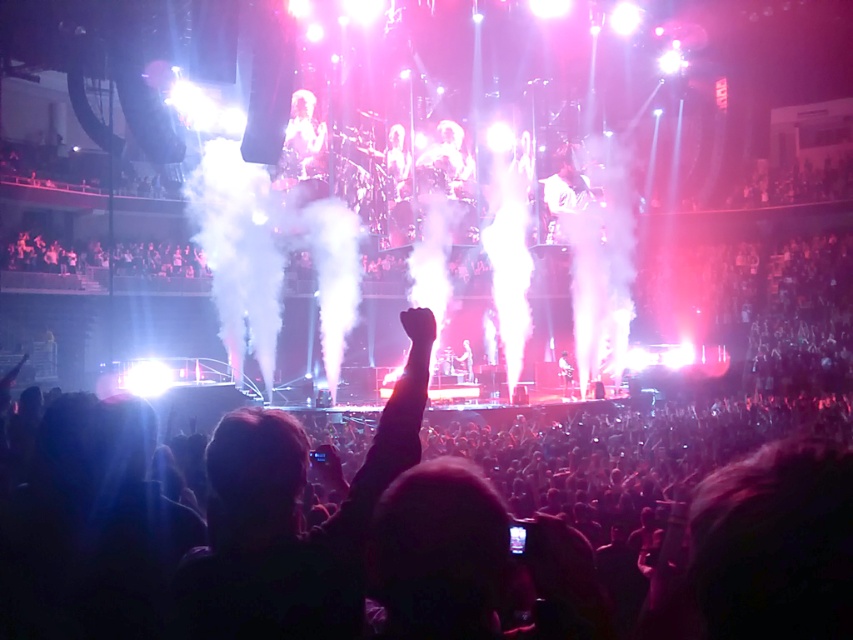
Consider the image. Does white fog at center come in front of shiny silver guitar at center?

Yes, white fog at center is closer to the viewer.

Is point (340, 252) positioned before point (471, 362)?

That is True.

Image resolution: width=853 pixels, height=640 pixels. Find the location of `white fog at center`. white fog at center is located at coordinates (268, 257).

In the scene shown: Which of these two, white fog at center or shiny black guitar at center, stands taller?

white fog at center is taller.

Does point (192, 200) lie in front of point (560, 372)?

No, it is not.

This screenshot has height=640, width=853. What do you see at coordinates (268, 257) in the screenshot?
I see `white fog at center` at bounding box center [268, 257].

In order to click on white fog at center in this screenshot , I will do `click(268, 257)`.

Between shiny black guitar at center and shiny silver guitar at center, which one is positioned higher?

shiny silver guitar at center is above.

Based on the photo, which is more to the left, shiny black guitar at center or shiny silver guitar at center?

shiny silver guitar at center

Which is in front, point (566, 353) or point (473, 371)?

Positioned in front is point (566, 353).

The height and width of the screenshot is (640, 853). Identify the location of shiny black guitar at center. (566, 374).